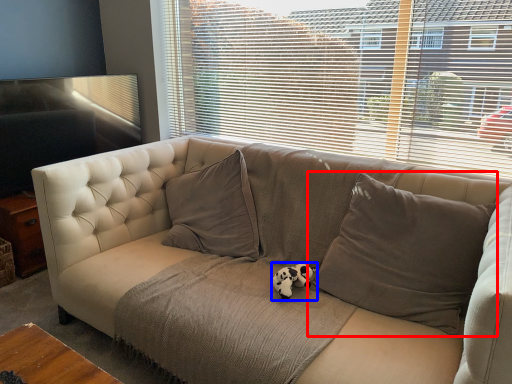
Question: Among these objects, which one is nearest to the camera, pillow (highlighted by a red box) or animal (highlighted by a blue box)?

Choices:
 (A) pillow
 (B) animal

Answer: (A)